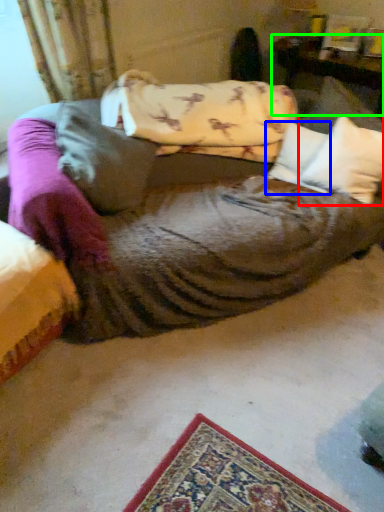
Question: Which object is the farthest from pillow (highlighted by a red box)? Choose among these: pillow (highlighted by a blue box) or furniture (highlighted by a green box).

Choices:
 (A) pillow
 (B) furniture

Answer: (B)